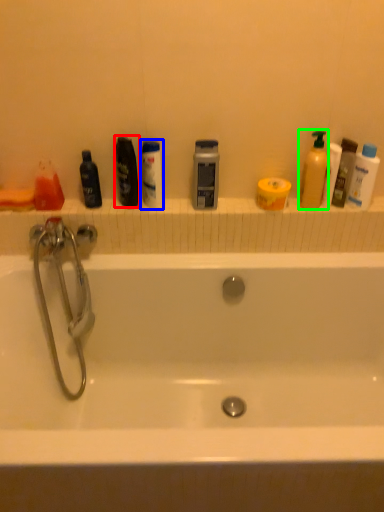
Question: Which is nearer to the mouthwash (highlighted by a red box)? mouthwash (highlighted by a blue box) or cleaning product (highlighted by a green box).

Choices:
 (A) mouthwash
 (B) cleaning product

Answer: (A)